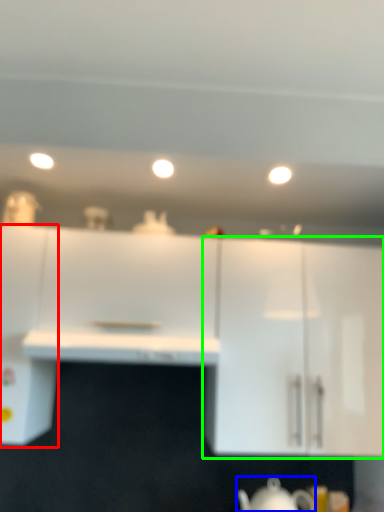
Question: Which is farther away from cabinetry (highlighted by a red box)? jug (highlighted by a blue box) or cabinetry (highlighted by a green box)?

Choices:
 (A) jug
 (B) cabinetry

Answer: (A)